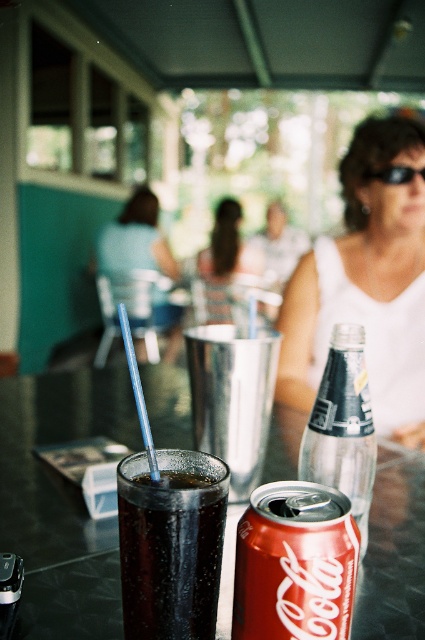
Can you confirm if glossy plastic table at center is positioned above clear glass bottle at center?

Actually, glossy plastic table at center is below clear glass bottle at center.

This screenshot has width=425, height=640. Describe the element at coordinates (62, 500) in the screenshot. I see `glossy plastic table at center` at that location.

The height and width of the screenshot is (640, 425). In order to click on glossy plastic table at center in this screenshot , I will do `click(62, 500)`.

Where is `glossy plastic table at center`? The image size is (425, 640). glossy plastic table at center is located at coordinates (62, 500).

What do you see at coordinates (136, 237) in the screenshot? The height and width of the screenshot is (640, 425). I see `matte blue shirt at upper left` at bounding box center [136, 237].

Does matte blue shirt at upper left have a greater height compared to smooth plastic cup at center?

Incorrect, matte blue shirt at upper left's height is not larger of smooth plastic cup at center's.

Image resolution: width=425 pixels, height=640 pixels. I want to click on matte blue shirt at upper left, so click(x=136, y=237).

Who is taller, glossy plastic table at center or smooth plastic cup at center?

smooth plastic cup at center

Does glossy plastic table at center come in front of smooth plastic cup at center?

Yes, it is in front of smooth plastic cup at center.

Does point (73, 419) lie behind point (209, 252)?

No, (73, 419) is closer to viewer.

I want to click on glossy plastic table at center, so click(62, 500).